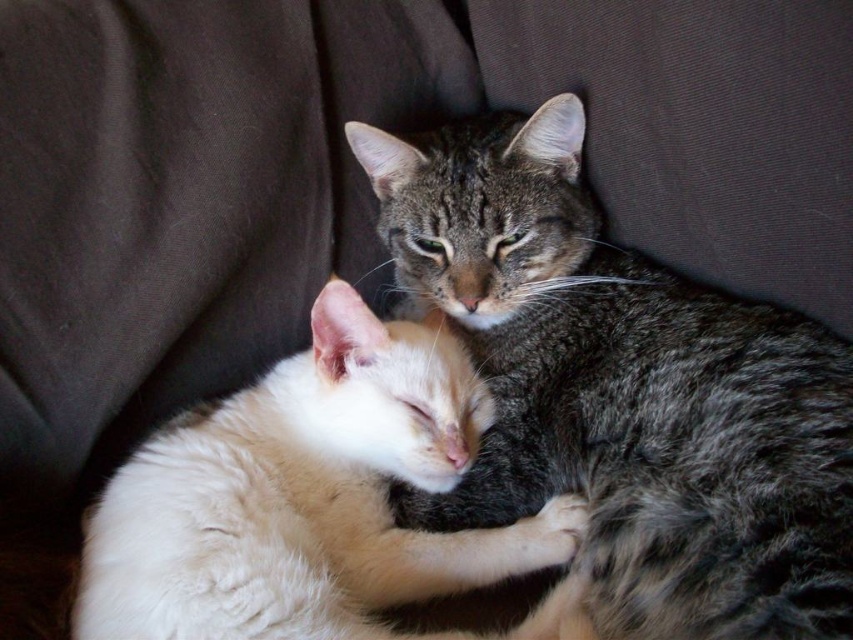
From the picture: You are observing two cats resting on a couch. You notice two specific points marked as point 1 and point 2. Point 1 is at coordinates (648,493) and point 2 is at (384,524). Based on their positions, which point is closer to you?

Point 1 is closer to the viewer than point 2.

From the picture: You are a cat owner who wants to place a small toy between the gray tabby cat at center and the fluffy white cat at center. The toy requires 20 centimeters of space to fit. Can you determine if there is enough space between them?

The gray tabby cat at center and the fluffy white cat at center are 19.59 centimeters apart from each other, which is less than the required 20 centimeters. Therefore, there isn not enough space to fit the toy between them.